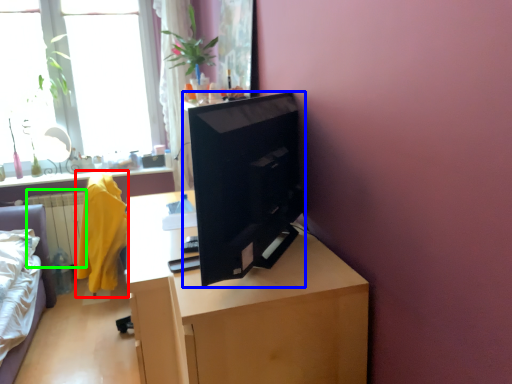
Question: Which object is the closest to the robe (highlighted by a red box)? Choose among these: computer (highlighted by a blue box) or radiator (highlighted by a green box).

Choices:
 (A) computer
 (B) radiator

Answer: (B)